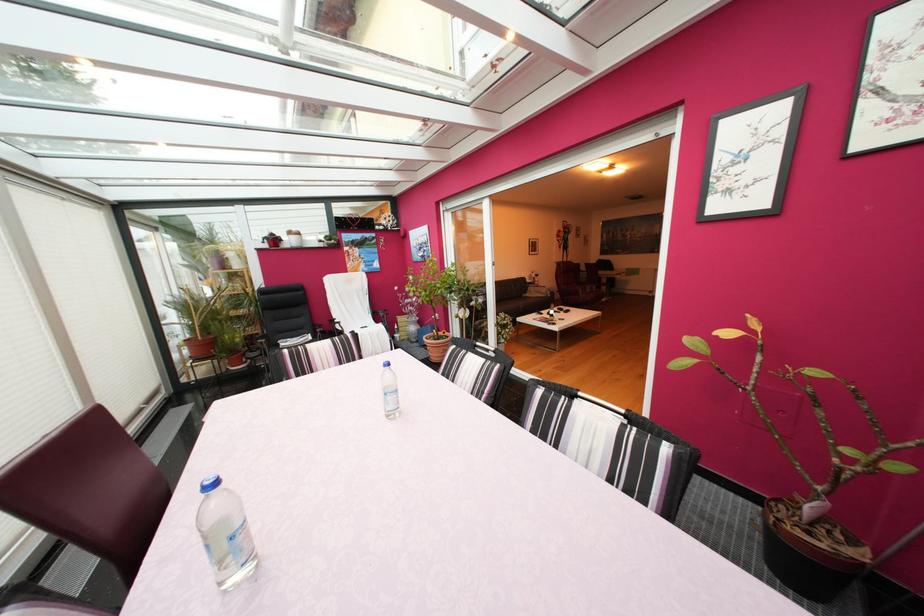
Find the location of a particular element. This screenshot has height=616, width=924. terracotta flower pot is located at coordinates (810, 552).